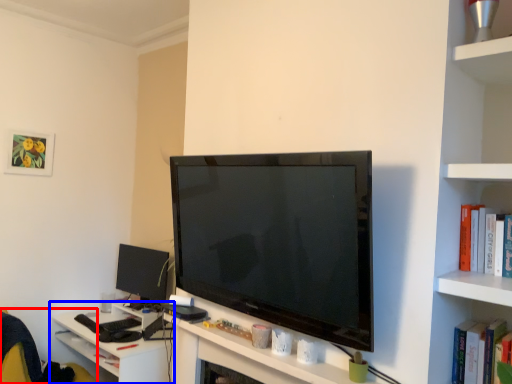
Question: Among these objects, which one is farthest to the camera, swivel chair (highlighted by a red box) or table (highlighted by a blue box)?

Choices:
 (A) swivel chair
 (B) table

Answer: (B)